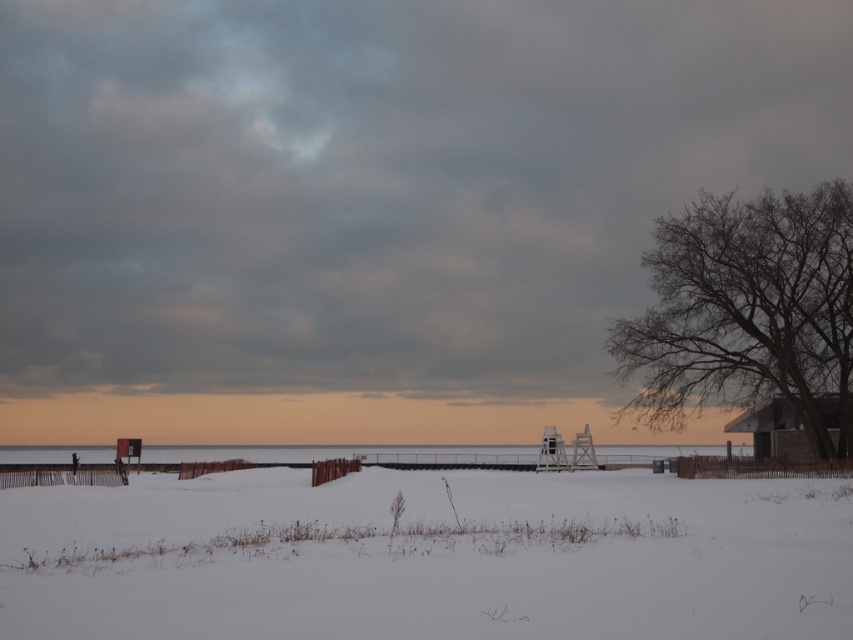
You are standing on the wooden pier and want to walk to the clear water at center. However, there is white fluffy snow at center in your path. Can you step around it or must you walk through it?

The white fluffy snow at center is positioned over clear water at center, so you must walk through the snow to reach the clear water at center.

Looking at this image, you are standing at the wooden cabin at right and want to walk to the white fluffy snow at center. Which direction should you face to head towards it?

You should face to the left because the white fluffy snow at center is located to the left of the wooden cabin at right.

You are a snowmobile operator planning to cross from the white fluffy snow at center to the clear water at center. The snowmobile requires at least 130 feet of clear path to safely accelerate and brake. Can you safely make this crossing?

The distance between the white fluffy snow at center and clear water at center is 129.83 feet, which is slightly less than the required 130 feet. Therefore, it is not safe to make the crossing with the snowmobile.